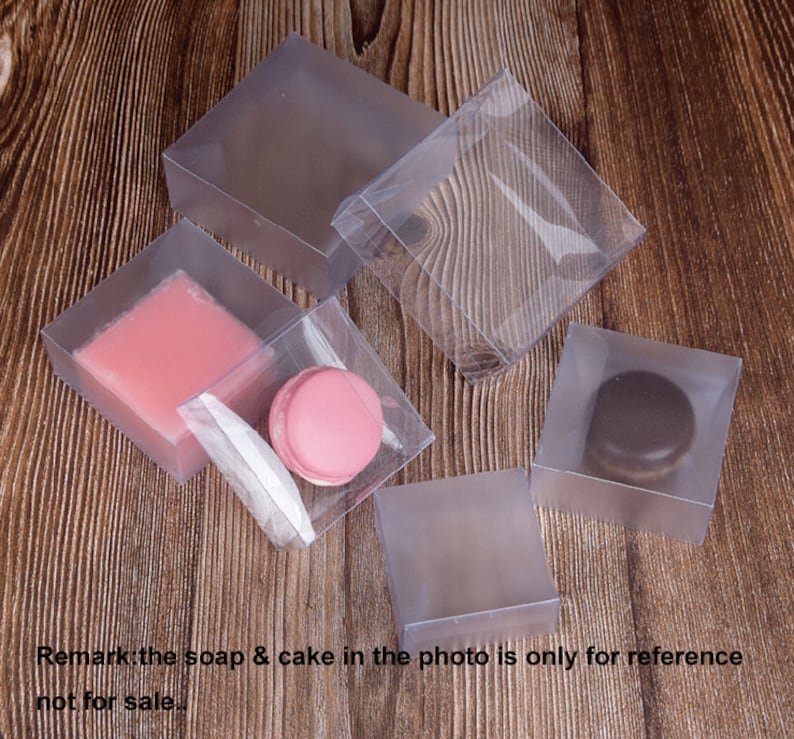
You are a GUI agent. You are given a task and a screenshot of the screen. Output one action in this format:
    pyautogui.click(x=<x>, y=<y>)
    Task: Click on the box
    
    Given the screenshot: What is the action you would take?
    pyautogui.click(x=307, y=183)